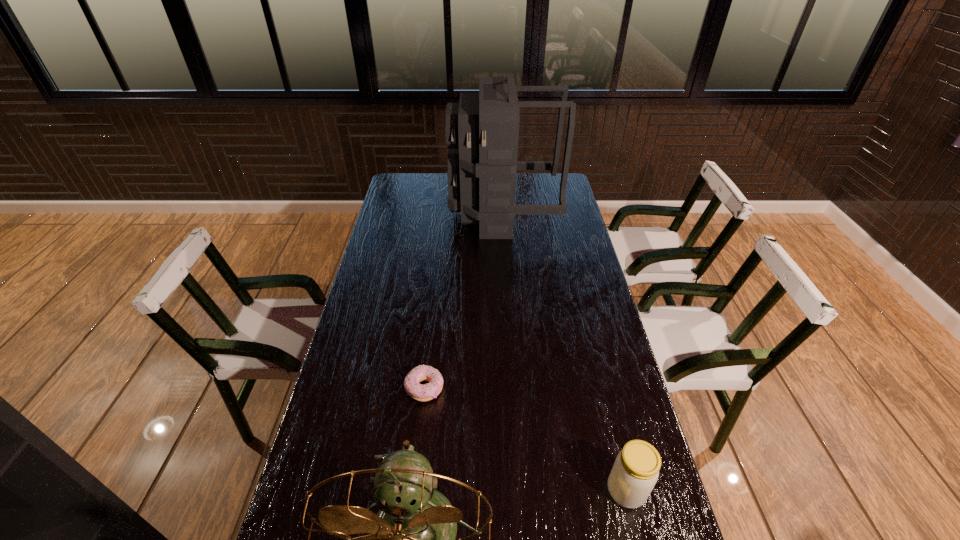
Locate an element on the screen. This screenshot has width=960, height=540. free area in between the second farthest object and the farthest object is located at coordinates (464, 301).

Where is `vacant area that lies between the third tallest object and the shortest object`? This screenshot has height=540, width=960. vacant area that lies between the third tallest object and the shortest object is located at coordinates (525, 440).

Identify which object is located as the second nearest to the backpack. Please provide its 2D coordinates. Your answer should be formatted as a tuple, i.e. [(x, y)], where the tuple contains the x and y coordinates of a point satisfying the conditions above.

[(635, 472)]

Locate which object is the closest to the farthest object. Please provide its 2D coordinates. Your answer should be formatted as a tuple, i.e. [(x, y)], where the tuple contains the x and y coordinates of a point satisfying the conditions above.

[(425, 392)]

At what (x,y) coordinates should I click in order to perform the action: click on free space in the image that satisfies the following two spatial constraints: 1. on the back side of the second shortest object; 2. on the front compartment of the farthest object. Please return your answer as a coordinate pair (x, y). Looking at the image, I should click on (559, 213).